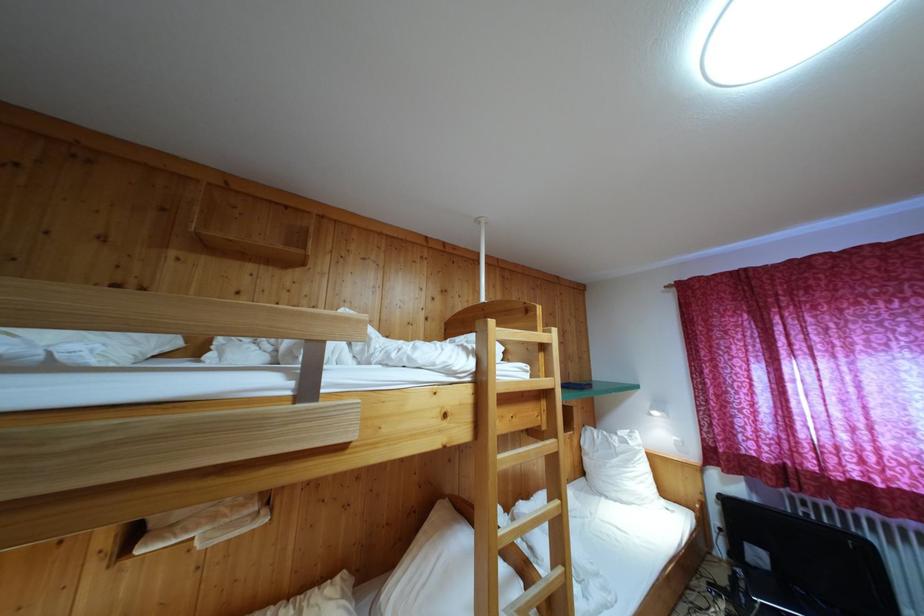
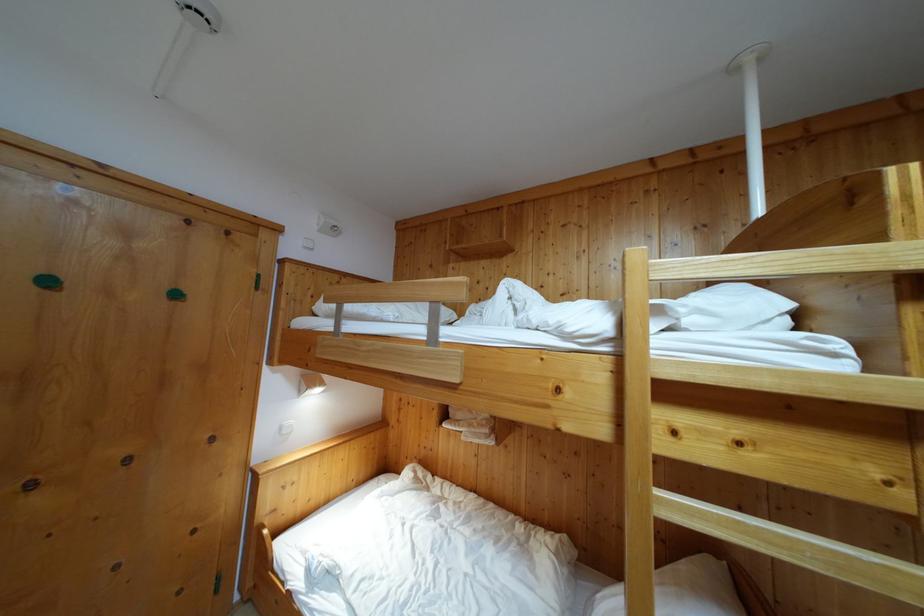
The point at (x=175, y=270) is marked in the first image. Where is the corresponding point in the second image?

(455, 278)